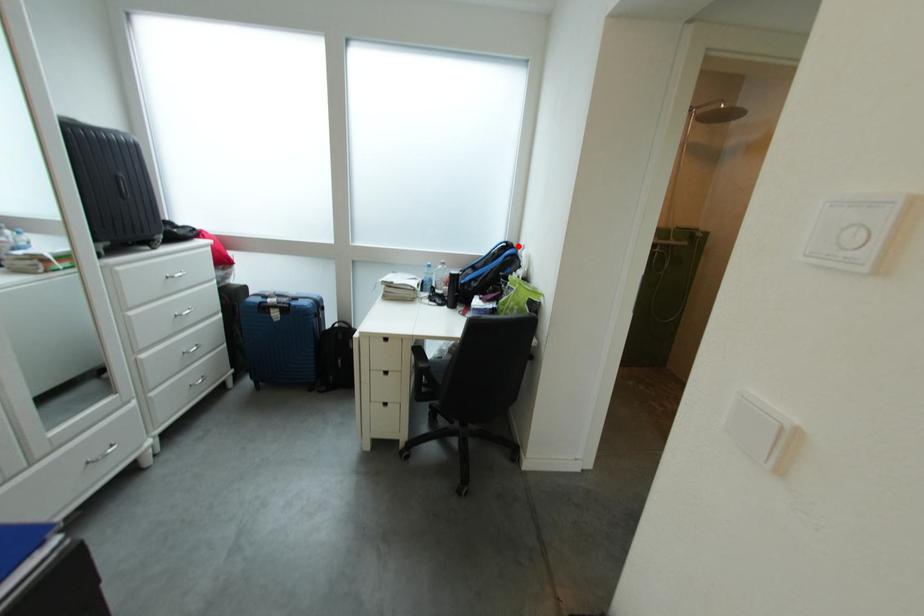
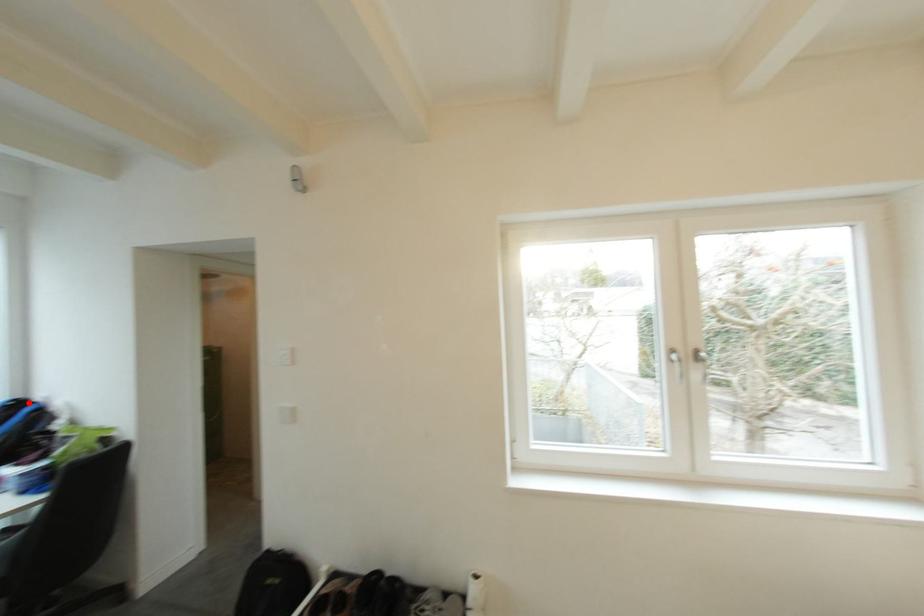
I am providing you with two images of the same scene from different viewpoints. A red point is marked on the first image and another point is marked on the second image. Is the red point in image1 aligned with the point shown in image2?

Yes